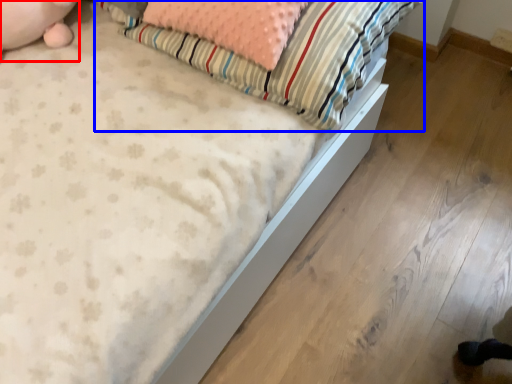
Question: Which object is closer to the camera taking this photo, animal (highlighted by a red box) or pillow (highlighted by a blue box)?

Choices:
 (A) animal
 (B) pillow

Answer: (B)